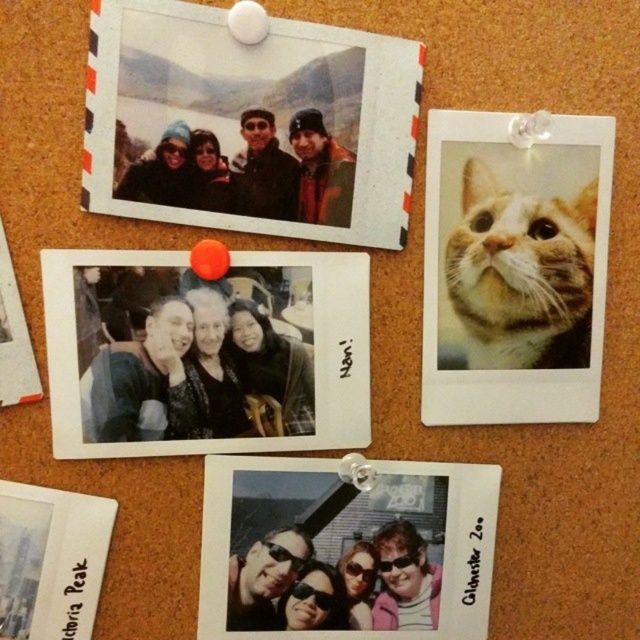
Who is shorter, matte plastic photo at bottom center or white paper postcard at lower left?

white paper postcard at lower left

Can you confirm if matte plastic photo at bottom center is smaller than white paper postcard at lower left?

No.

The width and height of the screenshot is (640, 640). What do you see at coordinates (346, 548) in the screenshot?
I see `matte plastic photo at bottom center` at bounding box center [346, 548].

I want to click on matte plastic photo at bottom center, so click(346, 548).

Can you confirm if matte black photo at upper left is taller than matte black photo at center?

Correct, matte black photo at upper left is much taller as matte black photo at center.

Can you confirm if matte black photo at upper left is thinner than matte black photo at center?

Incorrect, matte black photo at upper left's width is not less than matte black photo at center's.

Does point (225, 156) come in front of point (230, 394)?

Yes.

You are a GUI agent. You are given a task and a screenshot of the screen. Output one action in this format:
    pyautogui.click(x=<x>, y=<y>)
    Task: Click on the matte black photo at upper left
    
    Given the screenshot: What is the action you would take?
    pyautogui.click(x=250, y=122)

Can you confirm if matte black photo at center is positioned to the left of white paper postcard at lower left?

Incorrect, matte black photo at center is not on the left side of white paper postcard at lower left.

Can you confirm if matte black photo at center is bigger than white paper postcard at lower left?

Indeed, matte black photo at center has a larger size compared to white paper postcard at lower left.

What do you see at coordinates (205, 353) in the screenshot? I see `matte black photo at center` at bounding box center [205, 353].

Locate an element on the screen. The image size is (640, 640). matte black photo at center is located at coordinates (205, 353).